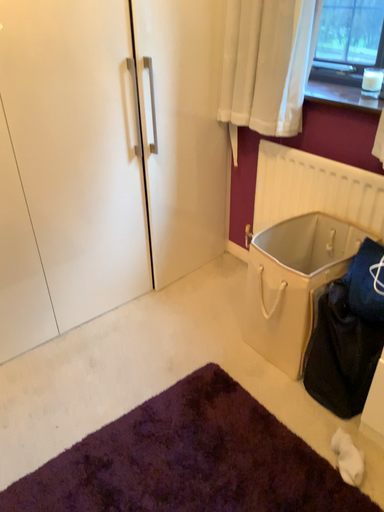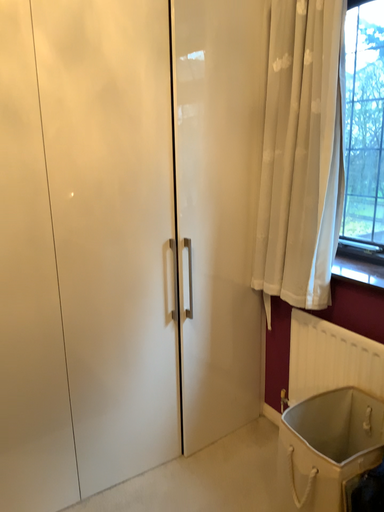
Question: How did the camera likely rotate when shooting the video?

Choices:
 (A) rotated upward
 (B) rotated downward

Answer: (A)